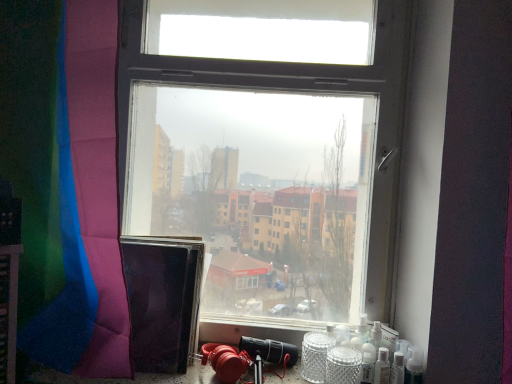
Image resolution: width=512 pixels, height=384 pixels. Describe the element at coordinates (382, 367) in the screenshot. I see `clear glass wine bottle at lower right` at that location.

How much space does clear glass jar at lower right, the first glass jar when ordered from left to right, occupy vertically?

It is 9.85 centimeters.

This screenshot has height=384, width=512. I want to click on transparent glass window at center, so click(x=269, y=174).

Measure the distance between point [349,251] and camera.

Point [349,251] and camera are 4.04 feet apart.

Where is `clear glass wine bottle at lower right`? clear glass wine bottle at lower right is located at coordinates (382, 367).

How much distance is there between clear glass jar at lower right, the first glass jar when ordered from left to right, and clear glass wine bottle at lower right?

They are 6.00 inches apart.

Find the location of a particular element. Image resolution: width=512 pixels, height=384 pixels. wine bottle on the right of clear glass jar at lower right, the second glass jar in the right-to-left sequence is located at coordinates (382, 367).

Can you confirm if clear glass jar at lower right, the second glass jar in the right-to-left sequence, is wider than clear glass wine bottle at lower right?

Correct, the width of clear glass jar at lower right, the second glass jar in the right-to-left sequence, exceeds that of clear glass wine bottle at lower right.

Can you tell me how much clear glass jar at lower right, the second glass jar in the right-to-left sequence, and clear glass wine bottle at lower right differ in facing direction?

The facing directions of clear glass jar at lower right, the second glass jar in the right-to-left sequence, and clear glass wine bottle at lower right are 0.000218 degrees apart.

How much distance is there between shiny polyester curtain at left and silver textured glass jar at lower right, positioned as the 2th glass jar in left-to-right order?

They are 28.63 inches apart.

Is shiny polyester curtain at left outside of silver textured glass jar at lower right, which ranks as the 1th glass jar in right-to-left order?

That's correct, shiny polyester curtain at left is outside of silver textured glass jar at lower right, which ranks as the 1th glass jar in right-to-left order.

From the image's perspective, would you say shiny polyester curtain at left is positioned over silver textured glass jar at lower right, which ranks as the 1th glass jar in right-to-left order?

Yes, from the image's perspective, shiny polyester curtain at left is on top of silver textured glass jar at lower right, which ranks as the 1th glass jar in right-to-left order.

Are shiny polyester curtain at left and silver textured glass jar at lower right, positioned as the 2th glass jar in left-to-right order, far apart?

They are positioned close to each other.

Looking at this image, how distant is transparent glass window at center from shiny polyester curtain at left?

transparent glass window at center and shiny polyester curtain at left are 16.37 inches apart.

Is transparent glass window at center beside shiny polyester curtain at left?

No, transparent glass window at center is not with shiny polyester curtain at left.

Is transparent glass window at center wider or thinner than shiny polyester curtain at left?

Clearly, transparent glass window at center has more width compared to shiny polyester curtain at left.

In the scene shown: Is shiny polyester curtain at left a part of transparent glass window at center?

No, transparent glass window at center does not contain shiny polyester curtain at left.

Which object is positioned more to the right, transparent glass window at center or silver textured glass jar at lower right, which ranks as the 1th glass jar in right-to-left order?

silver textured glass jar at lower right, which ranks as the 1th glass jar in right-to-left order.

Which object is further away from the camera taking this photo, transparent glass window at center or silver textured glass jar at lower right, which ranks as the 1th glass jar in right-to-left order?

Positioned behind is transparent glass window at center.

Is silver textured glass jar at lower right, positioned as the 2th glass jar in left-to-right order, a part of transparent glass window at center?

Actually, silver textured glass jar at lower right, positioned as the 2th glass jar in left-to-right order, is outside transparent glass window at center.

Is transparent glass window at center beside silver textured glass jar at lower right, positioned as the 2th glass jar in left-to-right order?

transparent glass window at center is not next to silver textured glass jar at lower right, positioned as the 2th glass jar in left-to-right order, and they're not touching.

Considering their positions, is clear glass wine bottle at lower right located in front of or behind silver textured glass jar at lower right, positioned as the 2th glass jar in left-to-right order?

clear glass wine bottle at lower right is behind silver textured glass jar at lower right, positioned as the 2th glass jar in left-to-right order.

Find the location of a particular element. The height and width of the screenshot is (384, 512). wine bottle below the silver textured glass jar at lower right, which ranks as the 1th glass jar in right-to-left order (from a real-world perspective) is located at coordinates (382, 367).

Are clear glass wine bottle at lower right and silver textured glass jar at lower right, positioned as the 2th glass jar in left-to-right order, making contact?

clear glass wine bottle at lower right and silver textured glass jar at lower right, positioned as the 2th glass jar in left-to-right order, are not in contact.

Considering the sizes of objects clear glass wine bottle at lower right and silver textured glass jar at lower right, positioned as the 2th glass jar in left-to-right order, in the image provided, who is smaller, clear glass wine bottle at lower right or silver textured glass jar at lower right, positioned as the 2th glass jar in left-to-right order,?

clear glass wine bottle at lower right is smaller.

From a real-world perspective, is silver textured glass jar at lower right, positioned as the 2th glass jar in left-to-right order, beneath clear glass wine bottle at lower right?

No, from a real-world perspective, silver textured glass jar at lower right, positioned as the 2th glass jar in left-to-right order, is not under clear glass wine bottle at lower right.

Looking at the image, does silver textured glass jar at lower right, positioned as the 2th glass jar in left-to-right order, seem bigger or smaller compared to clear glass wine bottle at lower right?

Clearly, silver textured glass jar at lower right, positioned as the 2th glass jar in left-to-right order, is larger in size than clear glass wine bottle at lower right.

I want to click on glass jar that is the 1st one when counting upward from the clear glass wine bottle at lower right (from the image's perspective), so click(x=343, y=366).

Is silver textured glass jar at lower right, positioned as the 2th glass jar in left-to-right order, far away from clear glass wine bottle at lower right?

They are positioned close to each other.

From the image's perspective, between clear glass wine bottle at lower right and transparent glass window at center, which one is located above?

transparent glass window at center, from the image's perspective.

Based on the photo, is clear glass wine bottle at lower right far from transparent glass window at center?

clear glass wine bottle at lower right is near transparent glass window at center, not far away.

Is transparent glass window at center completely or partially inside clear glass wine bottle at lower right?

No, clear glass wine bottle at lower right does not contain transparent glass window at center.

Is clear glass wine bottle at lower right shorter than transparent glass window at center?

Yes, clear glass wine bottle at lower right is shorter than transparent glass window at center.

Starting from the clear glass wine bottle at lower right, which glass jar is the 2nd one to the left? Please provide its 2D coordinates.

[(315, 356)]

Identify the location of the 2nd glass jar counting from the right side of the shiny polyester curtain at left. The height and width of the screenshot is (384, 512). pyautogui.click(x=343, y=366).

Which object lies further to the anchor point silver textured glass jar at lower right, positioned as the 2th glass jar in left-to-right order, shiny polyester curtain at left or transparent glass window at center?

shiny polyester curtain at left.

Estimate the real-world distances between objects in this image. Which object is closer to silver textured glass jar at lower right, positioned as the 2th glass jar in left-to-right order, clear glass jar at lower right, the second glass jar in the right-to-left sequence, or transparent glass window at center?

The object closer to silver textured glass jar at lower right, positioned as the 2th glass jar in left-to-right order, is clear glass jar at lower right, the second glass jar in the right-to-left sequence.

Which object lies nearer to the anchor point transparent glass window at center, clear glass jar at lower right, the first glass jar when ordered from left to right, or silver textured glass jar at lower right, positioned as the 2th glass jar in left-to-right order?

The object closer to transparent glass window at center is clear glass jar at lower right, the first glass jar when ordered from left to right.

From the image, which object appears to be farther from clear glass wine bottle at lower right, clear glass jar at lower right, the first glass jar when ordered from left to right, or shiny polyester curtain at left?

shiny polyester curtain at left is further to clear glass wine bottle at lower right.

Which object lies nearer to the anchor point clear glass jar at lower right, the second glass jar in the right-to-left sequence, shiny polyester curtain at left or clear glass wine bottle at lower right?

clear glass wine bottle at lower right.

Based on their spatial positions, is clear glass jar at lower right, the second glass jar in the right-to-left sequence, or silver textured glass jar at lower right, which ranks as the 1th glass jar in right-to-left order, further from clear glass wine bottle at lower right?

clear glass jar at lower right, the second glass jar in the right-to-left sequence, is further to clear glass wine bottle at lower right.

Considering their positions, is silver textured glass jar at lower right, positioned as the 2th glass jar in left-to-right order, positioned closer to clear glass wine bottle at lower right than transparent glass window at center?

Based on the image, silver textured glass jar at lower right, positioned as the 2th glass jar in left-to-right order, appears to be nearer to clear glass wine bottle at lower right.

Looking at the image, which one is located closer to silver textured glass jar at lower right, positioned as the 2th glass jar in left-to-right order, clear glass wine bottle at lower right or shiny polyester curtain at left?

clear glass wine bottle at lower right.

The width and height of the screenshot is (512, 384). I want to click on glass jar situated between shiny polyester curtain at left and silver textured glass jar at lower right, positioned as the 2th glass jar in left-to-right order, from left to right, so click(x=315, y=356).

The image size is (512, 384). Identify the location of window situated between shiny polyester curtain at left and clear glass jar at lower right, the first glass jar when ordered from left to right, from left to right. (269, 174).

Find the location of a particular element. This screenshot has width=512, height=384. glass jar between transparent glass window at center and silver textured glass jar at lower right, which ranks as the 1th glass jar in right-to-left order, vertically is located at coordinates (315, 356).

Locate an element on the screen. The width and height of the screenshot is (512, 384). glass jar located between clear glass jar at lower right, the first glass jar when ordered from left to right, and clear glass wine bottle at lower right in the left-right direction is located at coordinates pyautogui.click(x=343, y=366).